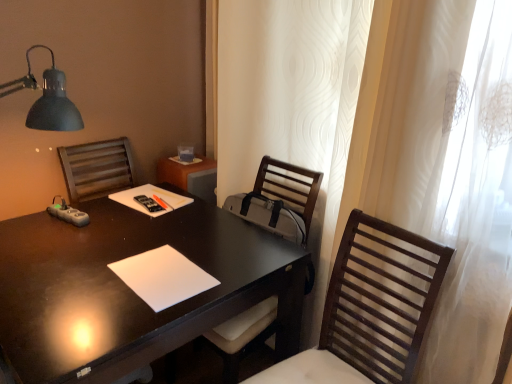
Find the location of a particular element. The width and height of the screenshot is (512, 384). vacant space in front of white matte notepad at center is located at coordinates (112, 323).